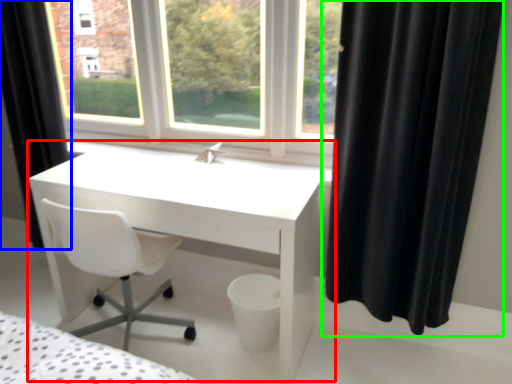
Question: Which object is positioned farthest from table (highlighted by a red box)? Select from curtain (highlighted by a blue box) and curtain (highlighted by a green box).

Choices:
 (A) curtain
 (B) curtain

Answer: (A)